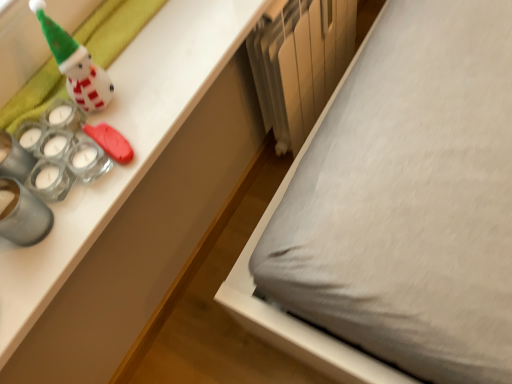
Image resolution: width=512 pixels, height=384 pixels. Describe the element at coordinates (133, 200) in the screenshot. I see `white glossy desk at upper left` at that location.

Where is `metallic silver radiator at lower center`? The image size is (512, 384). metallic silver radiator at lower center is located at coordinates (300, 63).

In order to click on white glossy desk at upper left in this screenshot , I will do `click(133, 200)`.

Considering the relative sizes of white glossy snowman at upper left and white glossy desk at upper left in the image provided, is white glossy snowman at upper left wider than white glossy desk at upper left?

Incorrect, the width of white glossy snowman at upper left does not surpass that of white glossy desk at upper left.

Can white glossy desk at upper left be found inside white glossy snowman at upper left?

Actually, white glossy desk at upper left is outside white glossy snowman at upper left.

In terms of size, does white glossy snowman at upper left appear bigger or smaller than white glossy desk at upper left?

Considering their sizes, white glossy snowman at upper left takes up less space than white glossy desk at upper left.

Can you tell me how much white glossy snowman at upper left and white glossy desk at upper left differ in facing direction?

white glossy snowman at upper left and white glossy desk at upper left are facing 1.07 degrees away from each other.

From the picture: From the image's perspective, which object appears higher, metallic silver radiator at lower center or white glossy desk at upper left?

metallic silver radiator at lower center, from the image's perspective.

Which object is further away from the camera taking this photo, metallic silver radiator at lower center or white glossy desk at upper left?

metallic silver radiator at lower center.

Where is `desk above the metallic silver radiator at lower center (from a real-world perspective)`? desk above the metallic silver radiator at lower center (from a real-world perspective) is located at coordinates (133, 200).

Which of these two, metallic silver radiator at lower center or white glossy desk at upper left, is thinner?

metallic silver radiator at lower center.

From the image's perspective, is white glossy desk at upper left located above or below white glossy snowman at upper left?

Clearly, from the image's perspective, white glossy desk at upper left is below white glossy snowman at upper left.

From the picture: Is white glossy desk at upper left with white glossy snowman at upper left?

There is a gap between white glossy desk at upper left and white glossy snowman at upper left.

Does point (158, 192) appear closer or farther from the camera than point (103, 97)?

Point (158, 192).

Is white glossy desk at upper left wider than white glossy snowman at upper left?

Yes, white glossy desk at upper left is wider than white glossy snowman at upper left.

Based on the photo, is white glossy snowman at upper left bigger or smaller than metallic silver radiator at lower center?

In the image, white glossy snowman at upper left appears to be smaller than metallic silver radiator at lower center.

Is white glossy snowman at upper left spatially inside metallic silver radiator at lower center, or outside of it?

white glossy snowman at upper left is not inside metallic silver radiator at lower center, it's outside.

Who is shorter, white glossy snowman at upper left or metallic silver radiator at lower center?

white glossy snowman at upper left is shorter.

Does white glossy snowman at upper left turn towards metallic silver radiator at lower center?

No, white glossy snowman at upper left is not turned towards metallic silver radiator at lower center.

Find the location of a particular element. This screenshot has height=384, width=512. radiator below the white glossy desk at upper left (from a real-world perspective) is located at coordinates (x=300, y=63).

Is white glossy desk at upper left wider than metallic silver radiator at lower center?

Yes, white glossy desk at upper left is wider than metallic silver radiator at lower center.

Who is bigger, white glossy desk at upper left or metallic silver radiator at lower center?

metallic silver radiator at lower center is bigger.

Is metallic silver radiator at lower center a part of white glossy desk at upper left?

No, white glossy desk at upper left does not contain metallic silver radiator at lower center.

From the image's perspective, which object appears higher, metallic silver radiator at lower center or white glossy snowman at upper left?

From the image's view, metallic silver radiator at lower center is above.

Looking at this image, who is taller, metallic silver radiator at lower center or white glossy snowman at upper left?

metallic silver radiator at lower center is taller.

This screenshot has height=384, width=512. I want to click on toy on the left of white glossy desk at upper left, so click(75, 64).

Where is `desk in front of the metallic silver radiator at lower center`? The width and height of the screenshot is (512, 384). desk in front of the metallic silver radiator at lower center is located at coordinates (133, 200).

Based on the photo, from the image, which object appears to be nearer to white glossy desk at upper left, metallic silver radiator at lower center or white glossy snowman at upper left?

metallic silver radiator at lower center.

Considering their positions, is metallic silver radiator at lower center positioned closer to white glossy snowman at upper left than white glossy desk at upper left?

white glossy desk at upper left is closer to white glossy snowman at upper left.

Looking at this image, from the image, which object appears to be nearer to white glossy snowman at upper left, white glossy desk at upper left or metallic silver radiator at lower center?

white glossy desk at upper left is closer to white glossy snowman at upper left.

When comparing their distances from metallic silver radiator at lower center, does white glossy desk at upper left or white glossy snowman at upper left seem closer?

white glossy desk at upper left is closer to metallic silver radiator at lower center.

In the scene shown: Considering their positions, is white glossy snowman at upper left positioned closer to metallic silver radiator at lower center than white glossy desk at upper left?

Among the two, white glossy desk at upper left is located nearer to metallic silver radiator at lower center.

From the picture: Looking at the image, which one is located further to white glossy desk at upper left, white glossy snowman at upper left or metallic silver radiator at lower center?

Based on the image, white glossy snowman at upper left appears to be further to white glossy desk at upper left.

Find the location of a particular element. This screenshot has width=512, height=384. desk between white glossy snowman at upper left and metallic silver radiator at lower center in the horizontal direction is located at coordinates (133, 200).